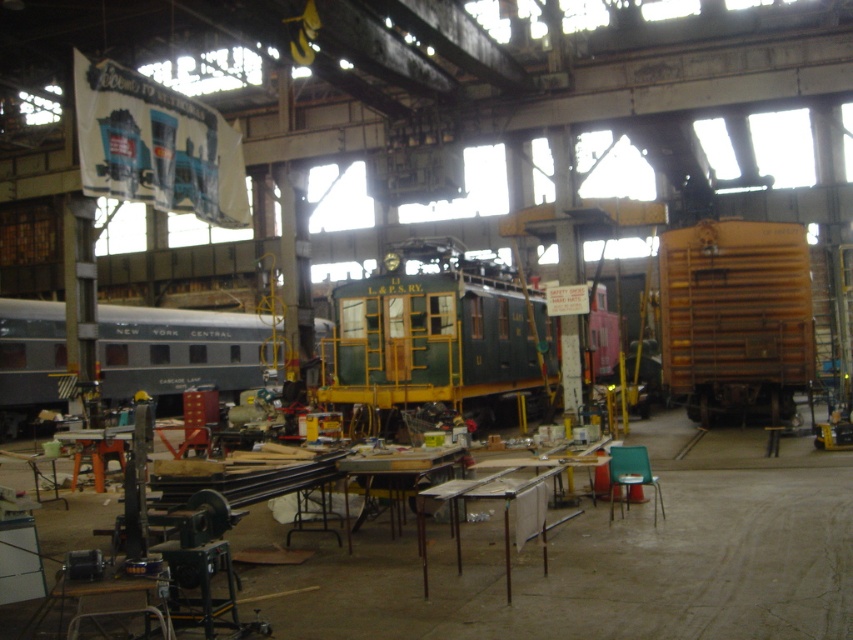
Question: Does green matte train car at center have a smaller size compared to rustic wood grain train car at right?

Choices:
 (A) no
 (B) yes

Answer: (A)

Question: Among these points, which one is farthest from the camera?

Choices:
 (A) (676, 387)
 (B) (495, 371)

Answer: (B)

Question: Among these objects, which one is farthest from the camera?

Choices:
 (A) green matte train car at center
 (B) silver polished metal train car at left

Answer: (B)

Question: Is green matte train car at center thinner than silver polished metal train car at left?

Choices:
 (A) no
 (B) yes

Answer: (A)

Question: Does rustic wood grain train car at right lie behind silver polished metal train car at left?

Choices:
 (A) no
 (B) yes

Answer: (A)

Question: Which point is farther to the camera?

Choices:
 (A) (795, 326)
 (B) (366, 317)

Answer: (B)